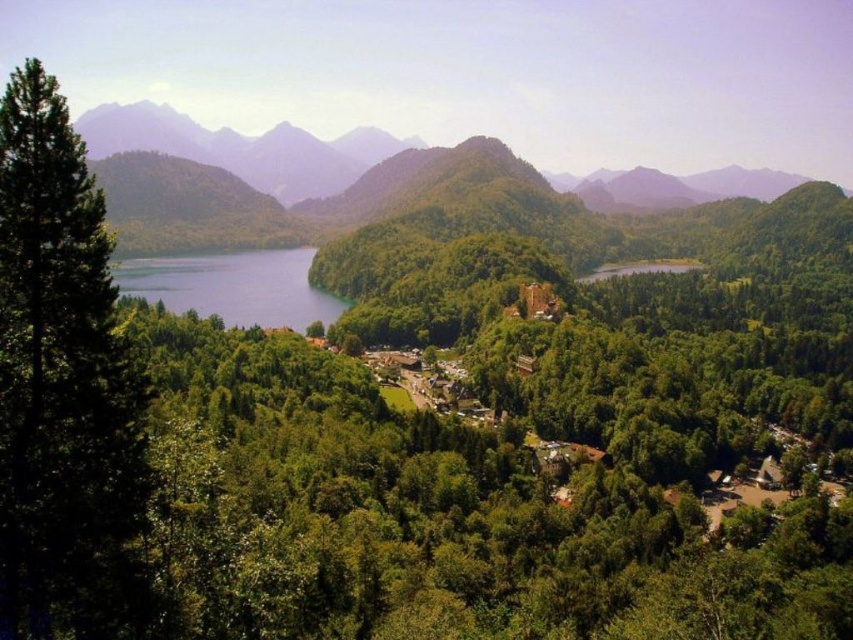
Question: Does green textured tree at left have a greater width compared to blue water at center left?

Choices:
 (A) no
 (B) yes

Answer: (A)

Question: Which of the following is the farthest from the observer?

Choices:
 (A) blue water at center left
 (B) green textured tree at left

Answer: (A)

Question: Is green textured tree at left above blue water at center left?

Choices:
 (A) yes
 (B) no

Answer: (B)

Question: Is green textured tree at left bigger than blue water at center left?

Choices:
 (A) yes
 (B) no

Answer: (B)

Question: Which of the following is the closest to the observer?

Choices:
 (A) (109, 483)
 (B) (131, 260)

Answer: (A)

Question: Among these objects, which one is nearest to the camera?

Choices:
 (A) blue water at center left
 (B) green textured tree at left

Answer: (B)